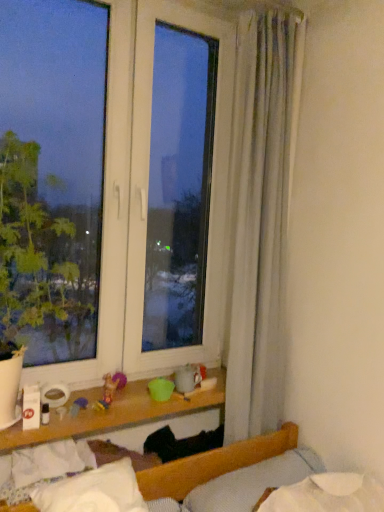
Question: Does white soft pillow at lower center, which is the first pillow from left to right, have a larger size compared to white soft pillow at lower right, the second pillow when ordered from left to right?

Choices:
 (A) no
 (B) yes

Answer: (A)

Question: Is white soft pillow at lower center, the second pillow in the right-to-left sequence, not close to white soft pillow at lower right, the 1th pillow when ordered from right to left?

Choices:
 (A) yes
 (B) no

Answer: (B)

Question: Is white soft pillow at lower center, the second pillow in the right-to-left sequence, facing towards white soft pillow at lower right, the 1th pillow when ordered from right to left?

Choices:
 (A) no
 (B) yes

Answer: (A)

Question: From a real-world perspective, is white soft pillow at lower center, the second pillow in the right-to-left sequence, located higher than white soft pillow at lower right, the second pillow when ordered from left to right?

Choices:
 (A) no
 (B) yes

Answer: (A)

Question: Is white soft pillow at lower center, the second pillow in the right-to-left sequence, behind white soft pillow at lower right, the 1th pillow when ordered from right to left?

Choices:
 (A) yes
 (B) no

Answer: (B)

Question: Is white soft pillow at lower center, the second pillow in the right-to-left sequence, taller than white soft pillow at lower right, the second pillow when ordered from left to right?

Choices:
 (A) no
 (B) yes

Answer: (A)

Question: Considering the relative sizes of white soft pillow at lower right, the 1th pillow when ordered from right to left, and white soft pillow at lower center, the second pillow in the right-to-left sequence, in the image provided, is white soft pillow at lower right, the 1th pillow when ordered from right to left, thinner than white soft pillow at lower center, the second pillow in the right-to-left sequence,?

Choices:
 (A) no
 (B) yes

Answer: (B)

Question: Can you confirm if white soft pillow at lower right, the 1th pillow when ordered from right to left, is smaller than white soft pillow at lower center, the second pillow in the right-to-left sequence?

Choices:
 (A) yes
 (B) no

Answer: (B)

Question: Considering the relative positions of white soft pillow at lower right, the second pillow when ordered from left to right, and white soft pillow at lower center, the second pillow in the right-to-left sequence, in the image provided, is white soft pillow at lower right, the second pillow when ordered from left to right, to the left of white soft pillow at lower center, the second pillow in the right-to-left sequence, from the viewer's perspective?

Choices:
 (A) yes
 (B) no

Answer: (B)

Question: Considering the relative sizes of white soft pillow at lower right, the 1th pillow when ordered from right to left, and white soft pillow at lower center, the second pillow in the right-to-left sequence, in the image provided, is white soft pillow at lower right, the 1th pillow when ordered from right to left, taller than white soft pillow at lower center, the second pillow in the right-to-left sequence,?

Choices:
 (A) yes
 (B) no

Answer: (A)

Question: Does white soft pillow at lower right, the 1th pillow when ordered from right to left, have a lesser height compared to white soft pillow at lower center, the second pillow in the right-to-left sequence?

Choices:
 (A) yes
 (B) no

Answer: (B)

Question: Is white soft pillow at lower right, the second pillow when ordered from left to right, behind white soft pillow at lower center, which is the first pillow from left to right?

Choices:
 (A) yes
 (B) no

Answer: (A)

Question: Considering the relative positions of white soft pillow at lower right, the 1th pillow when ordered from right to left, and white soft pillow at lower center, the second pillow in the right-to-left sequence, in the image provided, is white soft pillow at lower right, the 1th pillow when ordered from right to left, to the left or to the right of white soft pillow at lower center, the second pillow in the right-to-left sequence,?

Choices:
 (A) left
 (B) right

Answer: (B)